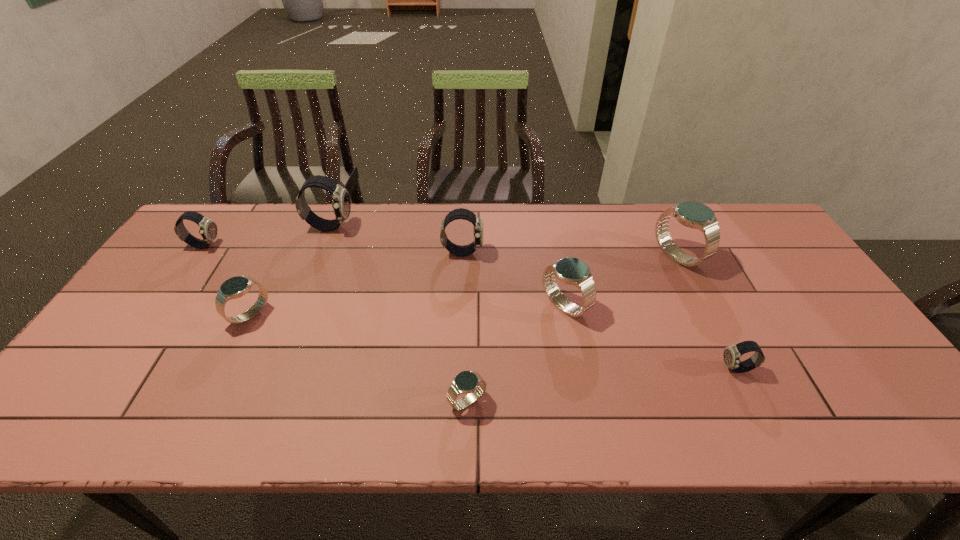
I want to click on the nearest dark watch, so click(731, 355).

Where is `the rightmost dark watch`? the rightmost dark watch is located at coordinates (731, 355).

Image resolution: width=960 pixels, height=540 pixels. Find the location of `the third blue watch from right to left`. the third blue watch from right to left is located at coordinates (466, 382).

In order to click on the nearest watch in this screenshot , I will do `click(466, 382)`.

Image resolution: width=960 pixels, height=540 pixels. I want to click on blank space located on the face of the biggest dark watch, so click(372, 227).

The image size is (960, 540). In order to click on blank space located on the front of the rightmost blue watch in this screenshot , I will do `click(716, 337)`.

Image resolution: width=960 pixels, height=540 pixels. I want to click on free region located on the face of the third dark watch from left to right, so click(551, 252).

Identify the location of vacant space located on the back of the third object from right to left. The height and width of the screenshot is (540, 960). (553, 240).

Where is `free space located on the face of the second smallest dark watch`? The width and height of the screenshot is (960, 540). free space located on the face of the second smallest dark watch is located at coordinates (252, 245).

Image resolution: width=960 pixels, height=540 pixels. I want to click on free spot located 0.240m on the back of the third biggest blue watch, so click(x=285, y=244).